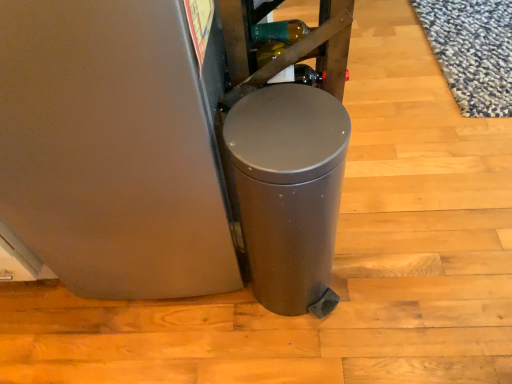
This screenshot has width=512, height=384. I want to click on unoccupied region to the right of satin metallic trash can at center, so click(x=370, y=277).